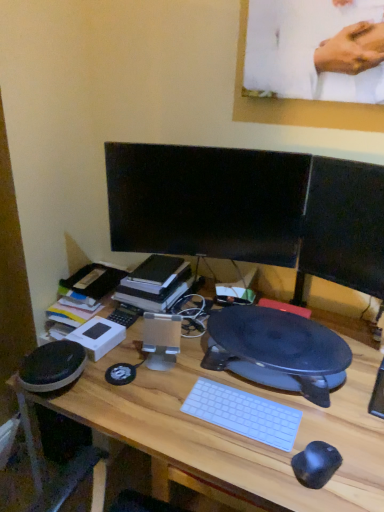
Question: From the image's perspective, is wooden desk at center positioned above or below black glossy monitor at center, arranged as the first computer monitor when viewed from the left?

Choices:
 (A) above
 (B) below

Answer: (B)

Question: Visually, is wooden desk at center positioned to the left or to the right of black glossy monitor at center, which is the 2th computer monitor in right-to-left order?

Choices:
 (A) right
 (B) left

Answer: (B)

Question: Considering the real-world distances, which object is closest to the black glossy monitor at center, arranged as the first computer monitor when viewed from the left?

Choices:
 (A) wooden desk at center
 (B) hardcover book at center
 (C) matte black monitor at center, which is the 2th computer monitor in left-to-right order

Answer: (C)

Question: Estimate the real-world distances between objects in this image. Which object is farther from the matte black monitor at center, the first computer monitor in the right-to-left sequence?

Choices:
 (A) hardcover book at center
 (B) black glossy monitor at center, which is the 2th computer monitor in right-to-left order
 (C) wooden desk at center

Answer: (A)